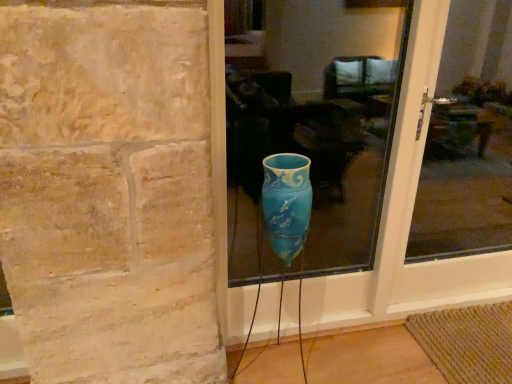
Identify the location of free spot in front of transparent glass door at center, the 1th glass window when ordered from right to left. The image size is (512, 384). (461, 344).